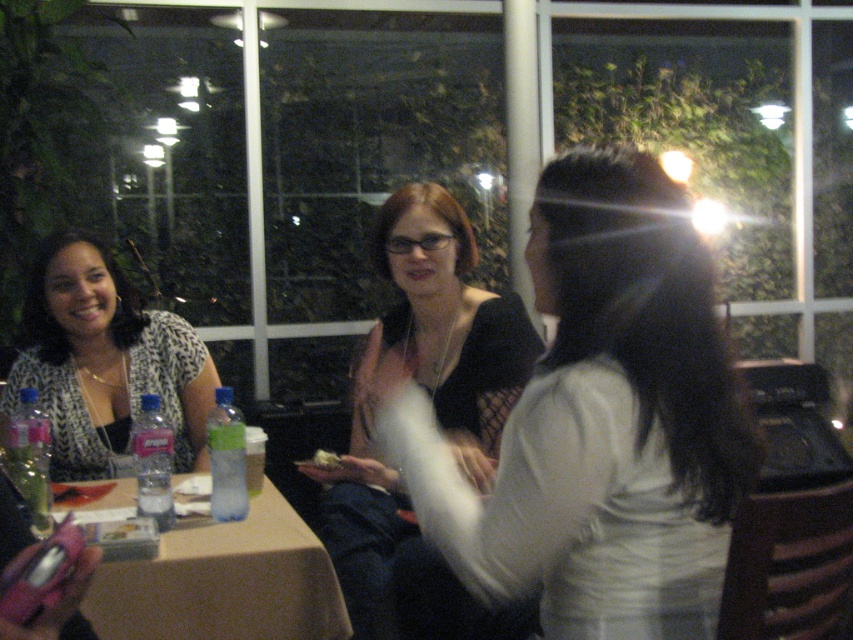
Question: Estimate the real-world distances between objects in this image. Which object is closer to the matte black shirt at center?

Choices:
 (A) matte black top at center
 (B) brown paper table at lower left
 (C) printed fabric blouse at left

Answer: (A)

Question: Is matte black shirt at center bigger than brown paper table at lower left?

Choices:
 (A) yes
 (B) no

Answer: (A)

Question: Is matte black shirt at center thinner than brown paper table at lower left?

Choices:
 (A) no
 (B) yes

Answer: (B)

Question: Which object is closer to the camera taking this photo?

Choices:
 (A) brown paper table at lower left
 (B) matte black shirt at center
 (C) matte black top at center

Answer: (B)

Question: Can you confirm if matte black shirt at center is positioned to the right of printed fabric blouse at left?

Choices:
 (A) yes
 (B) no

Answer: (A)

Question: Which object appears farthest from the camera in this image?

Choices:
 (A) matte black shirt at center
 (B) printed fabric blouse at left
 (C) brown paper table at lower left

Answer: (B)